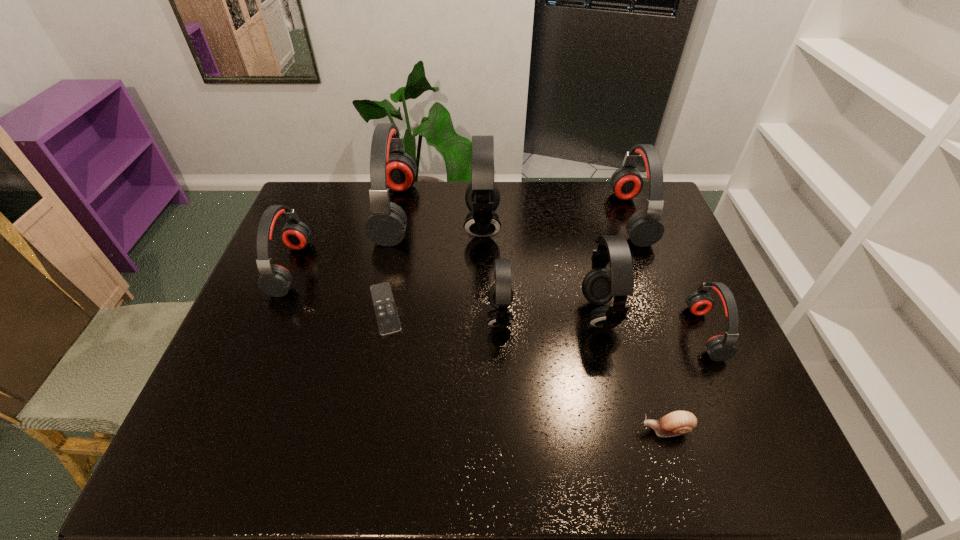
Locate an element on the screen. This screenshot has height=540, width=960. vacant area that satisfies the following two spatial constraints: 1. on the ear cups of the remote control; 2. on the left side of the leftmost red earphone is located at coordinates (274, 309).